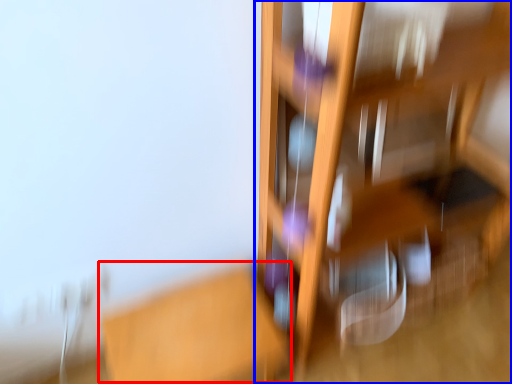
Question: Which object appears farthest to the camera in this image, table (highlighted by a red box) or furniture (highlighted by a blue box)?

Choices:
 (A) table
 (B) furniture

Answer: (A)